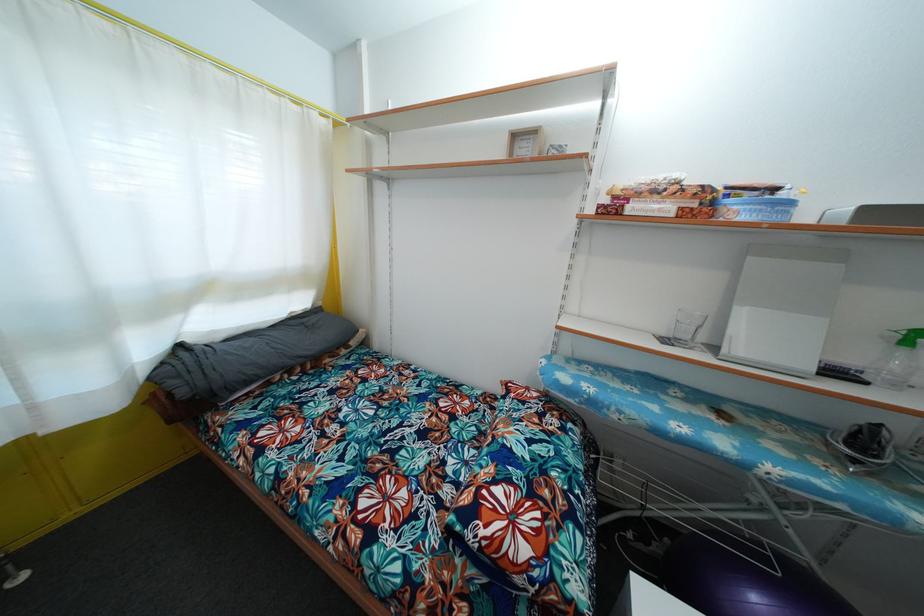
Locate an element on the screen. This screenshot has height=616, width=924. grey pillow is located at coordinates (249, 355).